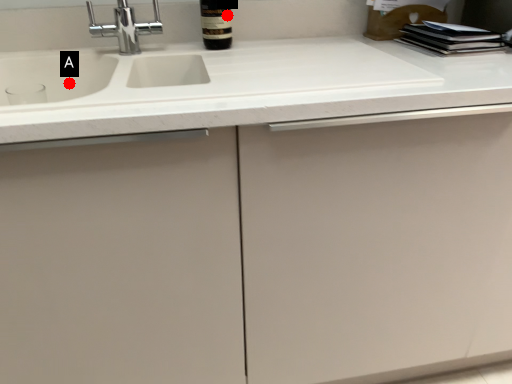
Question: Two points are circled on the image, labeled by A and B beside each circle. Which of the following is the closest to the observer?

Choices:
 (A) A is closer
 (B) B is closer

Answer: (B)